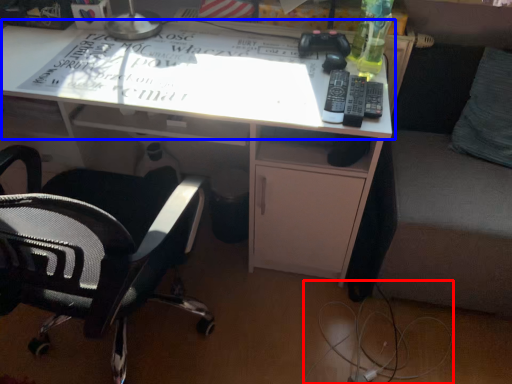
Question: Which object is further to the camera taking this photo, wire (highlighted by a red box) or table top (highlighted by a blue box)?

Choices:
 (A) wire
 (B) table top

Answer: (A)